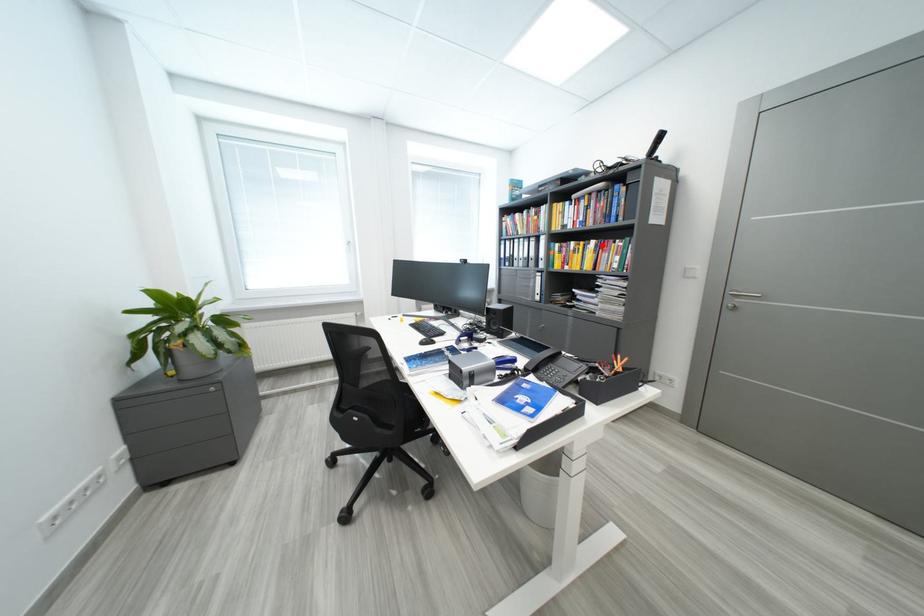
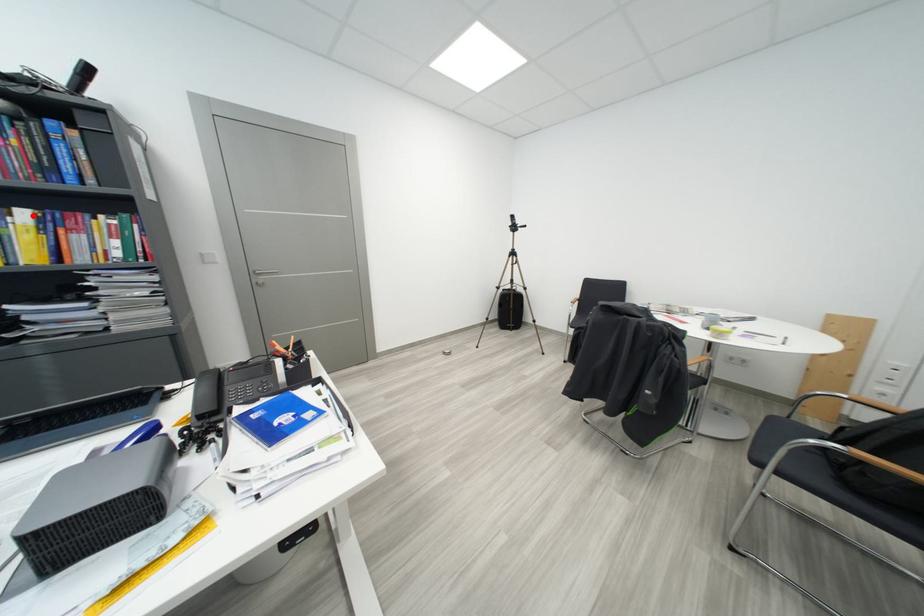
I am providing you with two images of the same scene from different viewpoints. A red point is marked on the first image and another point is marked on the second image. Does the point marked in image1 correspond to the same location as the one in image2?

Yes